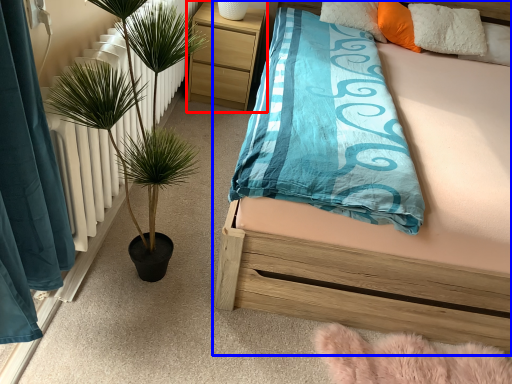
Question: Which of the following is the closest to the observer, nightstand (highlighted by a red box) or bed (highlighted by a blue box)?

Choices:
 (A) nightstand
 (B) bed

Answer: (B)